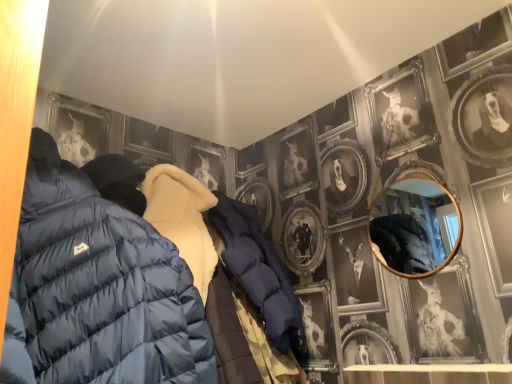
Question: Is gold-framed mirror at upper right to the left of matte blue puffer jacket at left from the viewer's perspective?

Choices:
 (A) yes
 (B) no

Answer: (B)

Question: From a real-world perspective, does gold-framed mirror at upper right stand above matte blue puffer jacket at left?

Choices:
 (A) no
 (B) yes

Answer: (B)

Question: Is gold-framed mirror at upper right shorter than matte blue puffer jacket at left?

Choices:
 (A) no
 (B) yes

Answer: (B)

Question: Does gold-framed mirror at upper right come behind matte blue puffer jacket at left?

Choices:
 (A) no
 (B) yes

Answer: (B)

Question: From the image's perspective, is gold-framed mirror at upper right beneath matte blue puffer jacket at left?

Choices:
 (A) no
 (B) yes

Answer: (A)

Question: Can you confirm if gold-framed mirror at upper right is positioned to the right of matte blue puffer jacket at left?

Choices:
 (A) yes
 (B) no

Answer: (A)

Question: Is the position of matte blue puffer jacket at left less distant than that of gold-framed mirror at upper right?

Choices:
 (A) yes
 (B) no

Answer: (A)

Question: From the image's perspective, does matte blue puffer jacket at left appear lower than gold-framed mirror at upper right?

Choices:
 (A) no
 (B) yes

Answer: (B)

Question: Is matte blue puffer jacket at left at the left side of gold-framed mirror at upper right?

Choices:
 (A) no
 (B) yes

Answer: (B)

Question: From a real-world perspective, is matte blue puffer jacket at left located higher than gold-framed mirror at upper right?

Choices:
 (A) yes
 (B) no

Answer: (B)

Question: Does matte blue puffer jacket at left turn towards gold-framed mirror at upper right?

Choices:
 (A) yes
 (B) no

Answer: (B)

Question: Does matte blue puffer jacket at left have a larger size compared to gold-framed mirror at upper right?

Choices:
 (A) no
 (B) yes

Answer: (B)

Question: In terms of width, does matte blue puffer jacket at left look wider or thinner when compared to gold-framed mirror at upper right?

Choices:
 (A) wide
 (B) thin

Answer: (A)